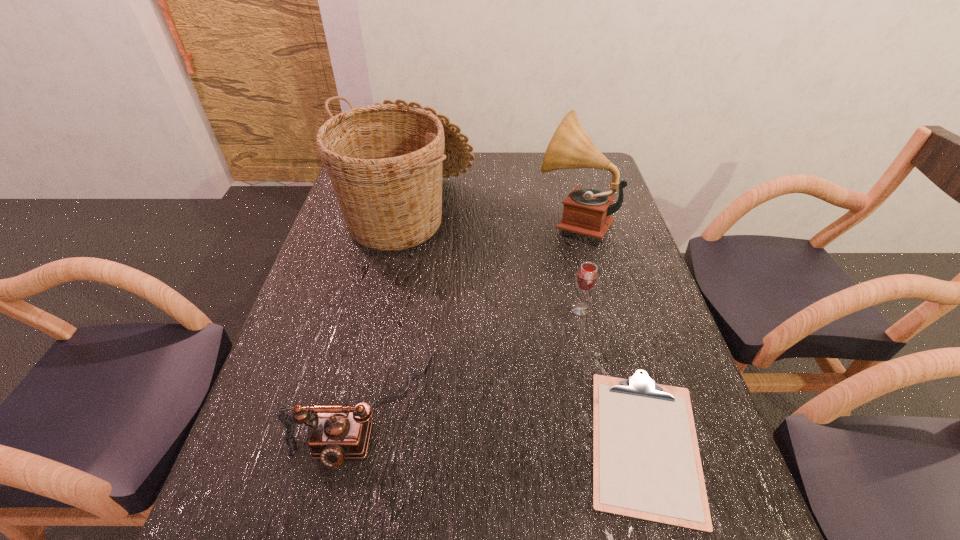
The width and height of the screenshot is (960, 540). Find the location of `basket`. basket is located at coordinates (386, 161).

The image size is (960, 540). In order to click on phonograph record in this screenshot , I will do `click(587, 212)`.

Where is `the third nearest object`? the third nearest object is located at coordinates (586, 278).

Find the location of a particular element. telephone is located at coordinates (339, 432).

At what (x,y) coordinates should I click in order to perform the action: click on clipboard. Please return your answer as a coordinate pair (x, y). Looking at the image, I should click on (646, 463).

Image resolution: width=960 pixels, height=540 pixels. Find the location of `vacant space located on the front of the basket`. vacant space located on the front of the basket is located at coordinates (377, 368).

Locate an element on the screen. vacant space located 0.140m on the horn of the phonograph record is located at coordinates (491, 220).

Locate an element on the screen. This screenshot has width=960, height=540. vacant space located on the horn of the phonograph record is located at coordinates (443, 220).

Image resolution: width=960 pixels, height=540 pixels. Find the location of `vacant region located 0.070m on the horn of the phonograph record`. vacant region located 0.070m on the horn of the phonograph record is located at coordinates (513, 220).

Identify the location of vacant region located 0.070m on the front of the third nearest object. (587, 340).